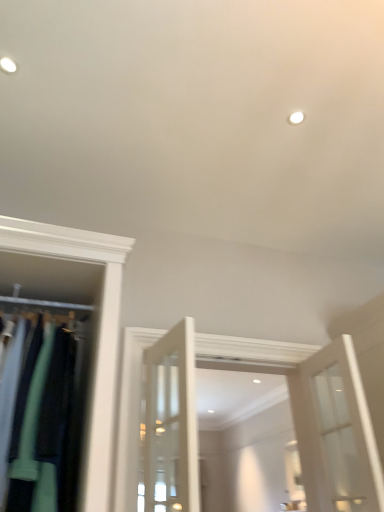
Describe the element at coordinates (335, 432) in the screenshot. The image size is (384, 512). I see `white glass door at right` at that location.

Where is `white glass door at right`? white glass door at right is located at coordinates (335, 432).

What is the approximate height of matte green fabric at left?

matte green fabric at left is 37.21 inches tall.

Identify the location of matte green fabric at left. This screenshot has height=512, width=384. (98, 332).

Describe the element at coordinates (98, 332) in the screenshot. This screenshot has height=512, width=384. I see `matte green fabric at left` at that location.

Find the location of a particular element. The width and height of the screenshot is (384, 512). white glass door at right is located at coordinates (335, 432).

Between white glass door at right and matte green fabric at left, which one appears on the right side from the viewer's perspective?

From the viewer's perspective, white glass door at right appears more on the right side.

Which object is closer to the camera taking this photo, white glass door at right or matte green fabric at left?

matte green fabric at left is more forward.

Based on the photo, which is less distant, (346,367) or (112,368)?

Point (346,367).

From the image's perspective, is white glass door at right located above matte green fabric at left?

Actually, white glass door at right appears below matte green fabric at left in the image.

From a real-world perspective, between white glass door at right and matte green fabric at left, who is vertically higher?

matte green fabric at left is physically above.

Which object is thinner, white glass door at right or matte green fabric at left?

white glass door at right is thinner.

Does white glass door at right have a lesser height compared to matte green fabric at left?

Indeed, white glass door at right has a lesser height compared to matte green fabric at left.

Considering the relative sizes of white glass door at right and matte green fabric at left in the image provided, is white glass door at right smaller than matte green fabric at left?

Yes, white glass door at right is smaller than matte green fabric at left.

Is white glass door at right spatially inside matte green fabric at left, or outside of it?

white glass door at right exists outside the volume of matte green fabric at left.

Can you see white glass door at right touching matte green fabric at left?

white glass door at right is not next to matte green fabric at left, and they're not touching.

Is white glass door at right facing towards matte green fabric at left?

Yes, white glass door at right faces towards matte green fabric at left.

How far apart are white glass door at right and matte green fabric at left?

4.83 feet.

I want to click on closet located above the white glass door at right (from the image's perspective), so click(x=98, y=332).

Visually, is matte green fabric at left positioned to the left or to the right of white glass door at right?

matte green fabric at left is to the left of white glass door at right.

In the image, is matte green fabric at left positioned in front of or behind white glass door at right?

Visually, matte green fabric at left is located in front of white glass door at right.

Considering the positions of point (85, 234) and point (313, 438), is point (85, 234) closer or farther from the camera than point (313, 438)?

Point (85, 234) appears to be closer to the viewer than point (313, 438).

From the image's perspective, is matte green fabric at left beneath white glass door at right?

Actually, matte green fabric at left appears above white glass door at right in the image.

From a real-world perspective, does matte green fabric at left sit lower than white glass door at right?

No, from a real-world perspective, matte green fabric at left is not beneath white glass door at right.

Is matte green fabric at left wider than white glass door at right?

Indeed, matte green fabric at left has a greater width compared to white glass door at right.

Can you confirm if matte green fabric at left is taller than white glass door at right?

Yes, matte green fabric at left is taller than white glass door at right.

Does matte green fabric at left have a smaller size compared to white glass door at right?

No.

Based on the photo, is matte green fabric at left spatially inside white glass door at right, or outside of it?

matte green fabric at left lies outside white glass door at right.

Are matte green fabric at left and white glass door at right making contact?

matte green fabric at left is not next to white glass door at right, and they're not touching.

Is matte green fabric at left aimed at white glass door at right?

No, matte green fabric at left does not turn towards white glass door at right.

How distant is matte green fabric at left from white glass door at right?

matte green fabric at left is 4.83 feet away from white glass door at right.

Where is `door behind the matte green fabric at left`? This screenshot has width=384, height=512. door behind the matte green fabric at left is located at coordinates (335, 432).

Where is `closet in front of the white glass door at right`? closet in front of the white glass door at right is located at coordinates (98, 332).

This screenshot has height=512, width=384. In order to click on closet that appears on the left of white glass door at right in this screenshot , I will do `click(98, 332)`.